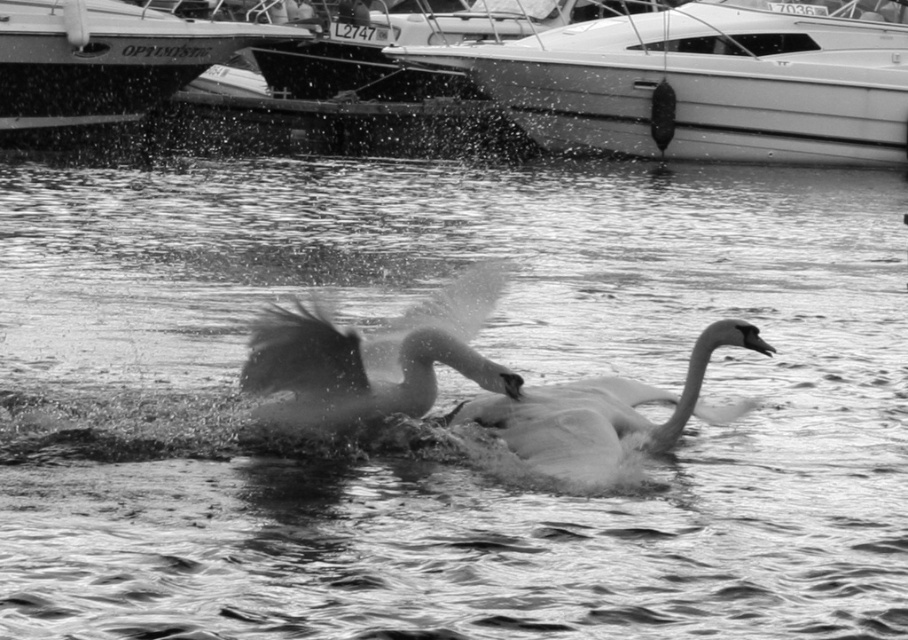
Can you confirm if silvery feathered swan at center is positioned to the right of smooth white swan at center?

In fact, silvery feathered swan at center is to the left of smooth white swan at center.

Which is in front, point (295, 321) or point (596, 477)?

Point (295, 321) is more forward.

Locate an element on the screen. The width and height of the screenshot is (908, 640). silvery feathered swan at center is located at coordinates (372, 356).

What are the coordinates of `metallic boat at upper left` in the screenshot? It's located at (104, 61).

Is metallic boat at upper left closer to camera compared to smooth white swan at center?

No.

Does point (147, 88) come behind point (697, 376)?

Yes, point (147, 88) is farther from viewer.

Identify the location of metallic boat at upper left. (104, 61).

Is point (648, 40) positioned before point (751, 337)?

That is False.

Based on the photo, does white glossy boat at upper center have a smaller size compared to smooth white swan at center?

Incorrect, white glossy boat at upper center is not smaller in size than smooth white swan at center.

Does point (665, 52) lie in front of point (551, 416)?

No, (665, 52) is behind (551, 416).

Locate an element on the screen. white glossy boat at upper center is located at coordinates (707, 81).